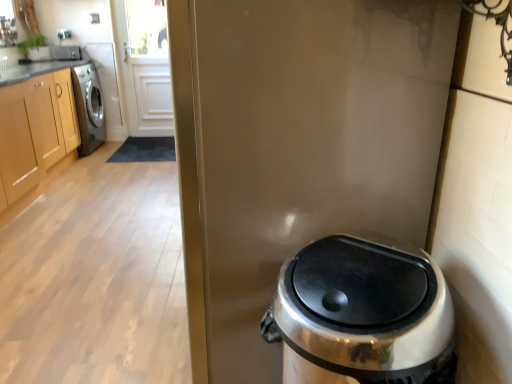
Describe the element at coordinates (35, 130) in the screenshot. I see `light brown wood cabinets at left` at that location.

What do you see at coordinates (308, 143) in the screenshot? I see `glossy metallic screen door at center` at bounding box center [308, 143].

Identify the location of light brown wood cabinets at left. (35, 130).

Which object is wider, light brown wood cabinets at left or satin silver trash can at lower right?

Wider between the two is light brown wood cabinets at left.

Is light brown wood cabinets at left next to satin silver trash can at lower right and touching it?

light brown wood cabinets at left and satin silver trash can at lower right are clearly separated.

Is light brown wood cabinets at left outside of satin silver trash can at lower right?

Yes, light brown wood cabinets at left is not within satin silver trash can at lower right.

Is light brown wood cabinets at left bigger or smaller than satin silver trash can at lower right?

Clearly, light brown wood cabinets at left is larger in size than satin silver trash can at lower right.

Between satin silver trash can at lower right and light brown wood cabinets at left, which one appears on the left side from the viewer's perspective?

light brown wood cabinets at left.

Identify the location of waste container below the light brown wood cabinets at left (from the image's perspective). This screenshot has width=512, height=384. (362, 314).

Is satin silver trash can at lower right far away from light brown wood cabinets at left?

satin silver trash can at lower right is positioned a significant distance from light brown wood cabinets at left.

Which is in front, point (369, 349) or point (22, 173)?

Point (369, 349)

Is glossy metallic screen door at center turned away from satin silver trash can at lower right?

No, satin silver trash can at lower right is not at the back of glossy metallic screen door at center.

Looking at their sizes, would you say glossy metallic screen door at center is wider or thinner than satin silver trash can at lower right?

Clearly, glossy metallic screen door at center has more width compared to satin silver trash can at lower right.

In the scene shown: How different are the orientations of glossy metallic screen door at center and satin silver trash can at lower right in degrees?

The angular difference between glossy metallic screen door at center and satin silver trash can at lower right is 1.02 degrees.

How different are the orientations of satin silver trash can at lower right and glossy metallic screen door at center in degrees?

The facing directions of satin silver trash can at lower right and glossy metallic screen door at center are 1.02 degrees apart.

In the scene shown: Is satin silver trash can at lower right shorter than glossy metallic screen door at center?

Correct, satin silver trash can at lower right is not as tall as glossy metallic screen door at center.

Would you say satin silver trash can at lower right is inside or outside glossy metallic screen door at center?

satin silver trash can at lower right is not inside glossy metallic screen door at center, it's outside.

Identify the location of cabinetry that is on the left side of glossy metallic screen door at center. The image size is (512, 384). (35, 130).

Is the position of glossy metallic screen door at center more distant than that of light brown wood cabinets at left?

No, glossy metallic screen door at center is closer to the viewer.

Is glossy metallic screen door at center positioned far away from light brown wood cabinets at left?

Indeed, glossy metallic screen door at center is not near light brown wood cabinets at left.

Between glossy metallic screen door at center and light brown wood cabinets at left, which one has less height?

light brown wood cabinets at left is shorter.

Is light brown wood cabinets at left wider than glossy metallic screen door at center?

Incorrect, the width of light brown wood cabinets at left does not surpass that of glossy metallic screen door at center.

Where is `screen door that appears below the light brown wood cabinets at left (from the image's perspective)`? This screenshot has height=384, width=512. screen door that appears below the light brown wood cabinets at left (from the image's perspective) is located at coordinates (308, 143).

Is light brown wood cabinets at left inside the boundaries of glossy metallic screen door at center, or outside?

light brown wood cabinets at left is located beyond the bounds of glossy metallic screen door at center.

Where is `waste container lying in front of the light brown wood cabinets at left`? The width and height of the screenshot is (512, 384). waste container lying in front of the light brown wood cabinets at left is located at coordinates tap(362, 314).

Find the location of a particular element. waste container that appears below the light brown wood cabinets at left (from the image's perspective) is located at coordinates (362, 314).

From the image, which object appears to be farther from satin silver trash can at lower right, light brown wood cabinets at left or glossy metallic screen door at center?

The object further to satin silver trash can at lower right is light brown wood cabinets at left.

Considering their positions, is glossy metallic screen door at center positioned further to satin silver trash can at lower right than light brown wood cabinets at left?

light brown wood cabinets at left lies further to satin silver trash can at lower right than the other object.

From the image, which object appears to be farther from glossy metallic screen door at center, satin silver trash can at lower right or light brown wood cabinets at left?

light brown wood cabinets at left lies further to glossy metallic screen door at center than the other object.

From the image, which object appears to be nearer to light brown wood cabinets at left, satin silver trash can at lower right or glossy metallic screen door at center?

Among the two, glossy metallic screen door at center is located nearer to light brown wood cabinets at left.

Consider the image. Estimate the real-world distances between objects in this image. Which object is further from glossy metallic screen door at center, light brown wood cabinets at left or satin silver trash can at lower right?

Based on the image, light brown wood cabinets at left appears to be further to glossy metallic screen door at center.

When comparing their distances from light brown wood cabinets at left, does glossy metallic screen door at center or satin silver trash can at lower right seem further?

Based on the image, satin silver trash can at lower right appears to be further to light brown wood cabinets at left.

Where is `screen door positioned between satin silver trash can at lower right and light brown wood cabinets at left from near to far`? screen door positioned between satin silver trash can at lower right and light brown wood cabinets at left from near to far is located at coordinates (308, 143).